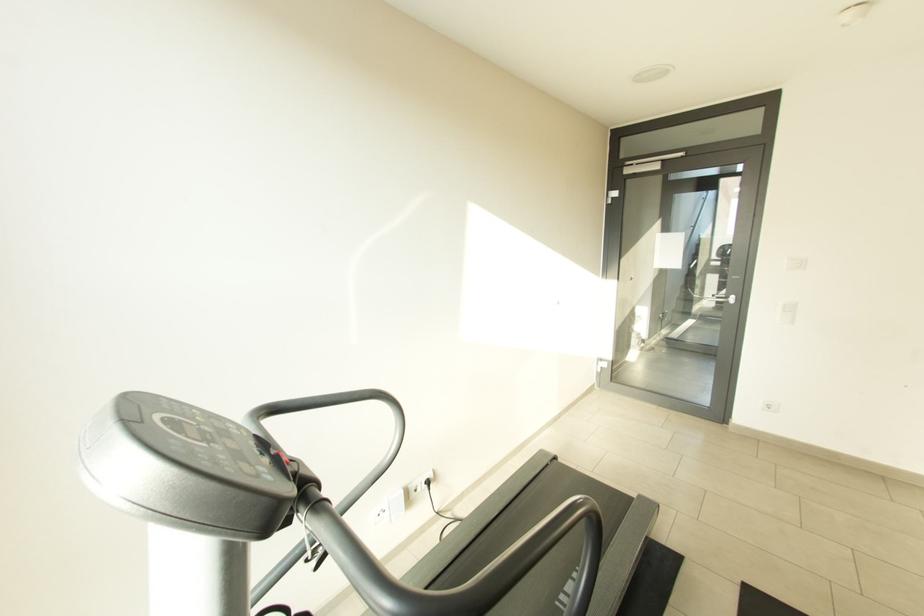
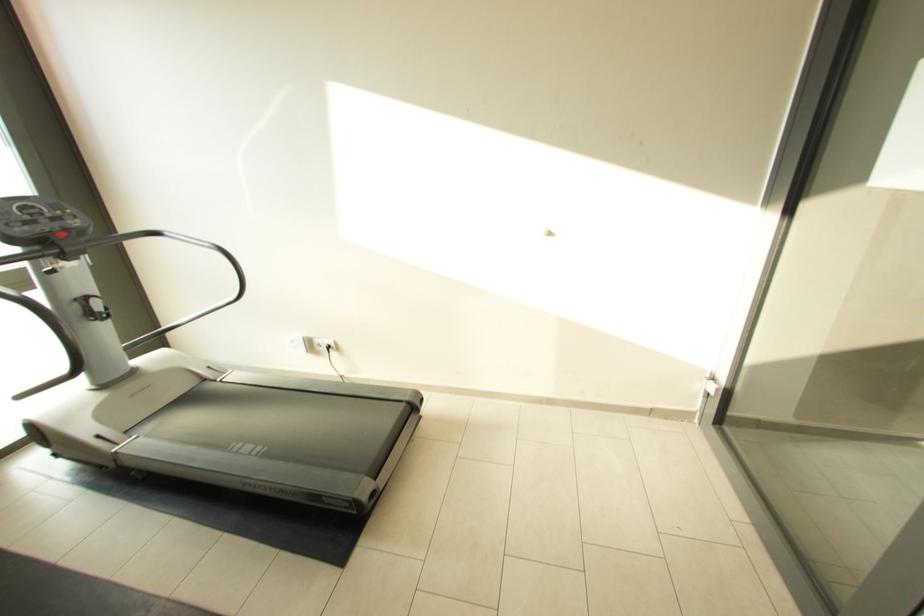
Find the pixel in the second image that matches (x=417, y=488) in the first image.

(322, 342)